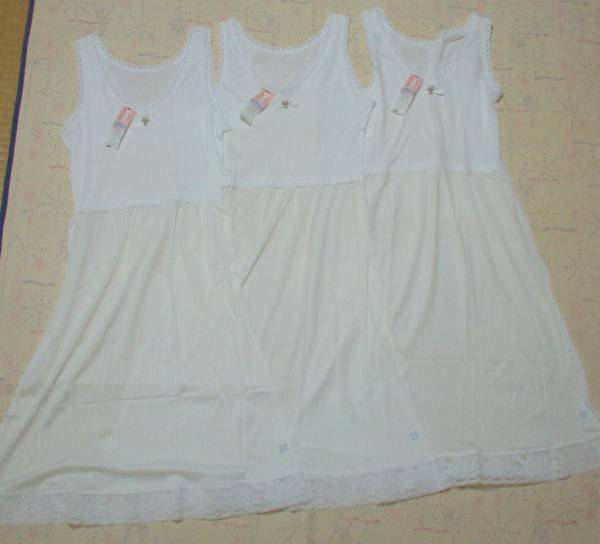
The image size is (600, 544). I want to click on green rug, so click(x=289, y=32).